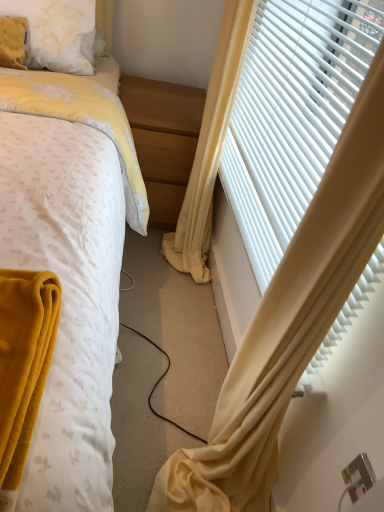
This screenshot has width=384, height=512. What are the coordinates of `vacant space in front of yellow fabric curtain at right, marked as the 1th curtain in a right-to-left arrangement` in the screenshot? It's located at (168, 298).